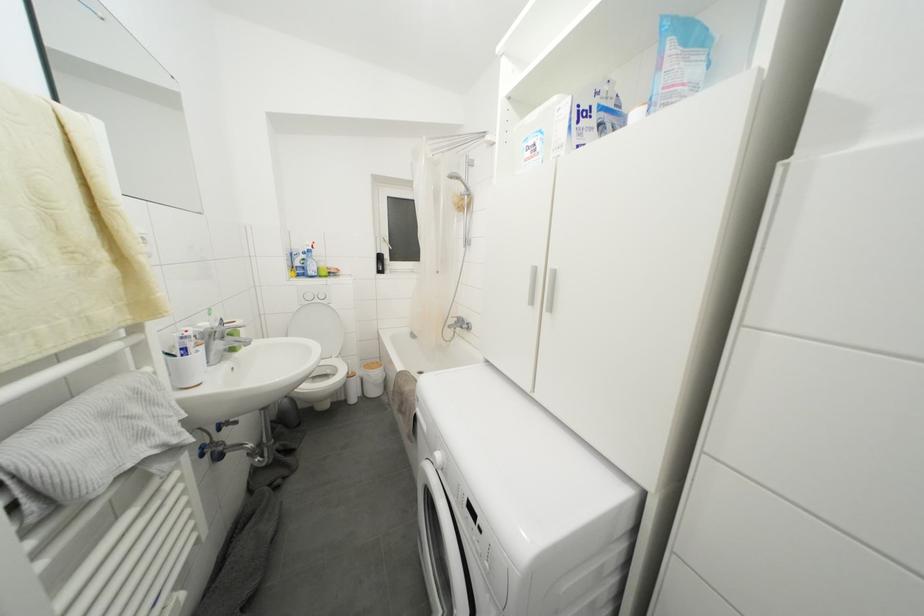
Locate an element on the screen. silver faucet handle is located at coordinates (454, 312).